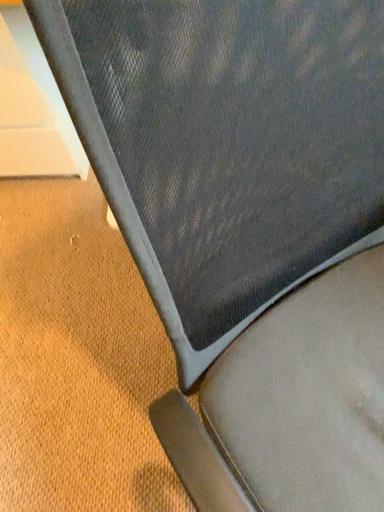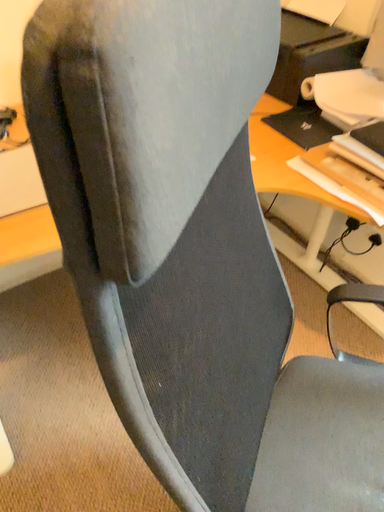
Question: How did the camera likely rotate when shooting the video?

Choices:
 (A) rotated downward
 (B) rotated upward

Answer: (B)